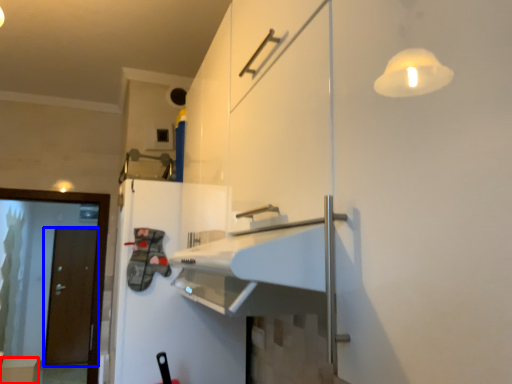
Question: Which object is further to the camera taking this photo, cabinetry (highlighted by a red box) or door (highlighted by a blue box)?

Choices:
 (A) cabinetry
 (B) door

Answer: (B)